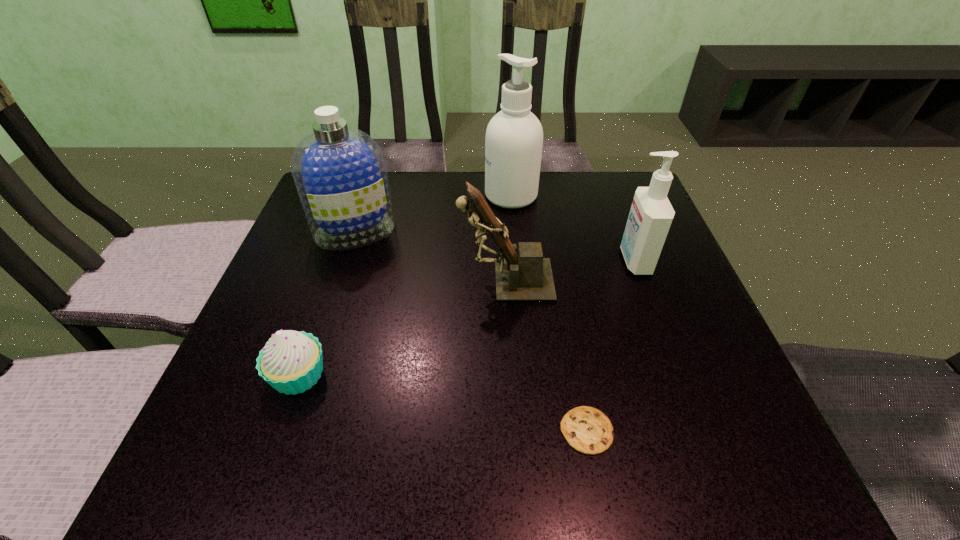
Identify which object is the closest to the leftmost cleansing agent. Please provide its 2D coordinates. Your answer should be formatted as a tuple, i.e. [(x, y)], where the tuple contains the x and y coordinates of a point satisfying the conditions above.

[(522, 274)]

Locate which object ranks third in proximity to the fifth tallest object. Please provide its 2D coordinates. Your answer should be formatted as a tuple, i.e. [(x, y)], where the tuple contains the x and y coordinates of a point satisfying the conditions above.

[(588, 430)]

Identify which cleansing agent is the second closest to the cupcake. Please provide its 2D coordinates. Your answer should be formatted as a tuple, i.e. [(x, y)], where the tuple contains the x and y coordinates of a point satisfying the conditions above.

[(514, 137)]

Where is `the second closest cleansing agent to the shortest object`? Image resolution: width=960 pixels, height=540 pixels. the second closest cleansing agent to the shortest object is located at coordinates (339, 172).

In order to click on free space in the image that satisfies the following two spatial constraints: 1. on the front label of the rightmost object; 2. on the front side of the fifth farthest object in this screenshot , I will do `click(678, 375)`.

The width and height of the screenshot is (960, 540). Identify the location of free space that satisfies the following two spatial constraints: 1. on the back side of the leftmost cleansing agent; 2. on the right side of the fifth farthest object. (348, 231).

The height and width of the screenshot is (540, 960). Find the location of `free space that satisfies the following two spatial constraints: 1. on the front label of the farthest cleansing agent; 2. on the left side of the nearest object`. free space that satisfies the following two spatial constraints: 1. on the front label of the farthest cleansing agent; 2. on the left side of the nearest object is located at coordinates (532, 430).

At what (x,y) coordinates should I click in order to perform the action: click on vacant space that satisfies the following two spatial constraints: 1. on the front side of the leftmost cleansing agent; 2. on the right side of the nearest object. Please return your answer as a coordinate pair (x, y). The height and width of the screenshot is (540, 960). Looking at the image, I should click on (289, 430).

In order to click on vacant area in the image that satisfies the following two spatial constraints: 1. on the back side of the fifth tallest object; 2. on the left side of the leftmost cleansing agent in this screenshot , I will do `click(348, 231)`.